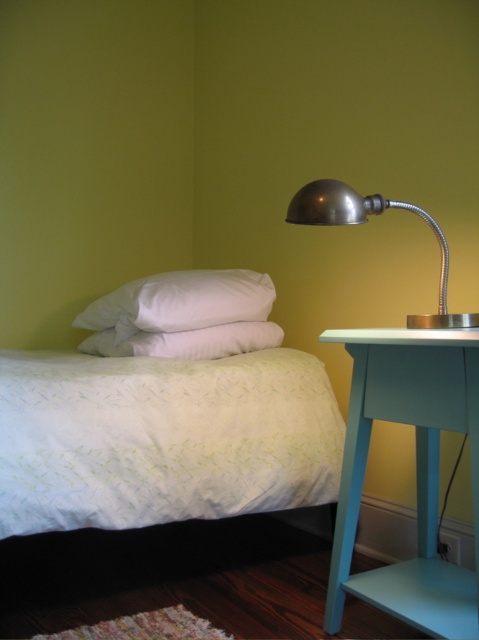
Is white textured blanket at lower left to the left of teal painted wood side table at right from the viewer's perspective?

Indeed, white textured blanket at lower left is positioned on the left side of teal painted wood side table at right.

Can you confirm if white textured blanket at lower left is positioned below teal painted wood side table at right?

Incorrect, white textured blanket at lower left is not positioned below teal painted wood side table at right.

Is point (115, 465) closer to camera compared to point (467, 406)?

No, (115, 465) is behind (467, 406).

I want to click on white textured blanket at lower left, so click(x=161, y=438).

Between white soft pillow at upper left and brushed metal desk lamp at right, which one is positioned lower?

white soft pillow at upper left is lower down.

Is white soft pillow at upper left to the left of brushed metal desk lamp at right from the viewer's perspective?

Yes, white soft pillow at upper left is to the left of brushed metal desk lamp at right.

Where is `white soft pillow at upper left`? The width and height of the screenshot is (479, 640). white soft pillow at upper left is located at coordinates (182, 300).

Find the location of `white soft pillow at upper left`. white soft pillow at upper left is located at coordinates (182, 300).

Is point (298, 220) less distant than point (205, 340)?

Yes, it is.

Is point (464, 314) positioned after point (257, 330)?

No, it is not.

Is point (420, 212) positioned behind point (277, 332)?

No, it is not.

Image resolution: width=479 pixels, height=640 pixels. In order to click on brushed metal desk lamp at right in this screenshot , I will do `click(364, 221)`.